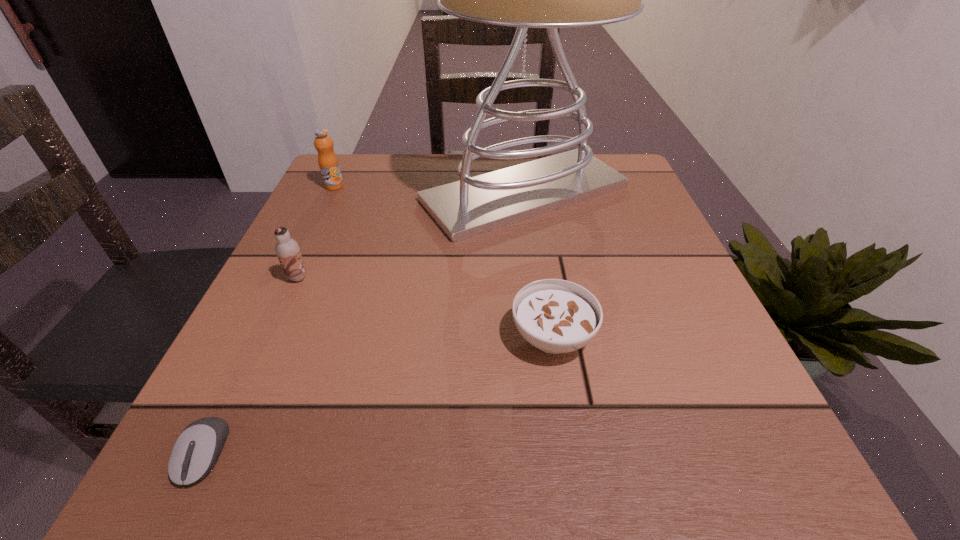
You are a GUI agent. You are given a task and a screenshot of the screen. Output one action in this format:
    pyautogui.click(x=<x>, y=<y>)
    Task: Click on the table lamp
    This screenshot has height=540, width=960.
    Given the screenshot: What is the action you would take?
    pyautogui.click(x=474, y=205)

Image resolution: width=960 pixels, height=540 pixels. I want to click on orange juice, so click(328, 162).

At what (x,y) coordinates should I click in order to perform the action: click on the third nearest object. Please return your answer as a coordinate pair (x, y). The image size is (960, 540). Looking at the image, I should click on (287, 250).

At what (x,y) coordinates should I click in order to perform the action: click on the third shortest object. Please return your answer as a coordinate pair (x, y). This screenshot has height=540, width=960. Looking at the image, I should click on (287, 250).

Locate an element on the screen. soup bowl is located at coordinates (556, 316).

Find the location of a particular element. The height and width of the screenshot is (540, 960). the second shortest object is located at coordinates (556, 316).

You are a GUI agent. You are given a task and a screenshot of the screen. Output one action in this format:
    pyautogui.click(x=<x>, y=<y>)
    Task: Click on the nearest object
    This screenshot has height=540, width=960.
    Given the screenshot: What is the action you would take?
    pyautogui.click(x=195, y=452)

At what (x,y) coordinates should I click in order to perform the action: click on the shortest object. Please return your answer as a coordinate pair (x, y). Looking at the image, I should click on (195, 452).

Where is `blank space located 0.180m on the left of the tallest object`? blank space located 0.180m on the left of the tallest object is located at coordinates (340, 193).

You are a GUI agent. You are given a task and a screenshot of the screen. Output one action in this format:
    pyautogui.click(x=<x>, y=<y>)
    Task: Click on the free location located on the front label of the orange juice
    The image size is (960, 540).
    Given the screenshot: What is the action you would take?
    pyautogui.click(x=303, y=251)